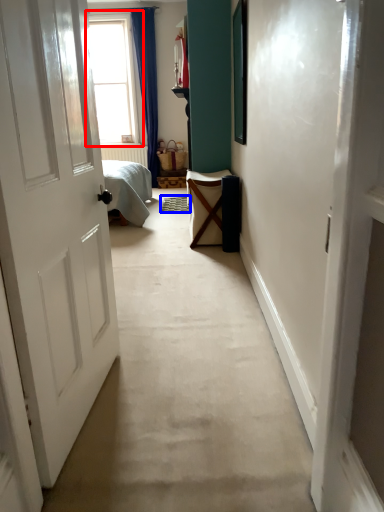
Question: Which of the following is the farthest to the observer, window (highlighted by a red box) or doormat (highlighted by a blue box)?

Choices:
 (A) window
 (B) doormat

Answer: (A)